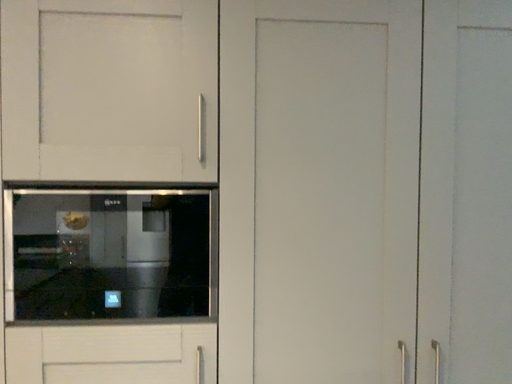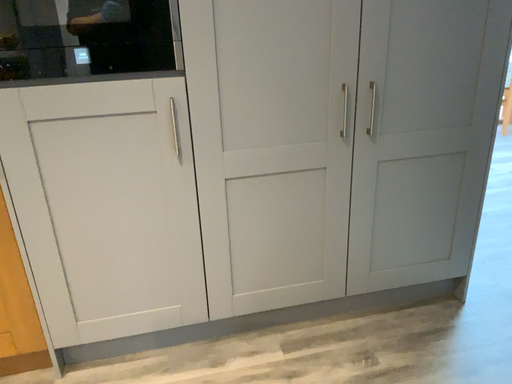
Question: How did the camera likely rotate when shooting the video?

Choices:
 (A) rotated downward
 (B) rotated upward

Answer: (A)